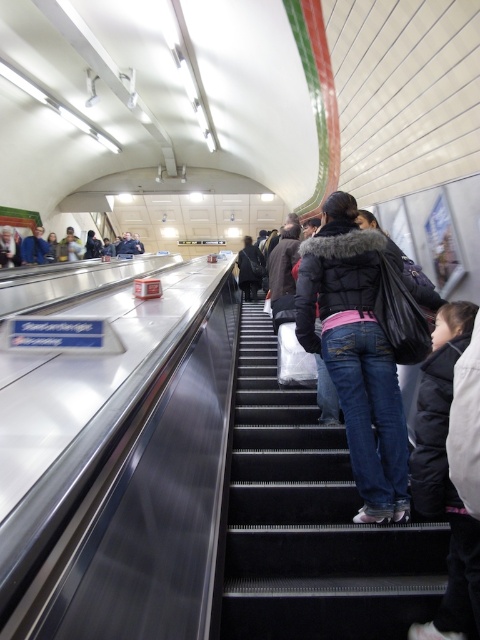
Can you confirm if black rubber stairs at center is shorter than dark blue jacket at center?

Yes, black rubber stairs at center is shorter than dark blue jacket at center.

Can you confirm if black rubber stairs at center is smaller than dark blue jacket at center?

Correct, black rubber stairs at center occupies less space than dark blue jacket at center.

The width and height of the screenshot is (480, 640). In order to click on black rubber stairs at center in this screenshot , I will do `click(311, 522)`.

Does point (404, 534) come behind point (52, 244)?

No.

Is black rubber stairs at center wider than dark gray jacket at upper left?

Yes, black rubber stairs at center is wider than dark gray jacket at upper left.

Is point (276, 580) in front of point (69, 234)?

Yes, it is.

The height and width of the screenshot is (640, 480). What are the coordinates of `black rubber stairs at center` in the screenshot? It's located at (311, 522).

Looking at this image, can you confirm if dark gray jacket at upper left is wider than dark blue jacket at center?

Yes.

Who is more forward, [56,260] or [249,268]?

Positioned in front is point [249,268].

Is point (71, 227) closer to viewer compared to point (251, 296)?

No, (71, 227) is behind (251, 296).

Identify the location of dark gray jacket at upper left. The height and width of the screenshot is (640, 480). (36, 246).